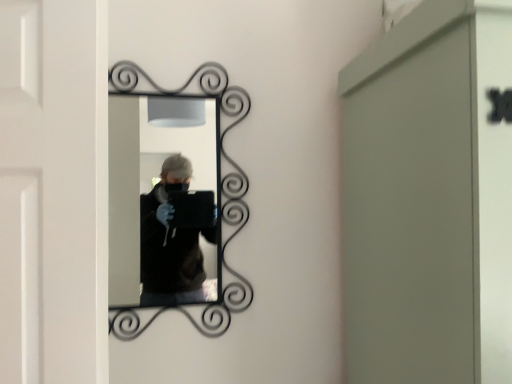
I want to click on metallic silver mirror at center, so click(158, 205).

This screenshot has height=384, width=512. What do you see at coordinates (158, 205) in the screenshot?
I see `metallic silver mirror at center` at bounding box center [158, 205].

The height and width of the screenshot is (384, 512). In order to click on metallic silver mirror at center in this screenshot , I will do `click(158, 205)`.